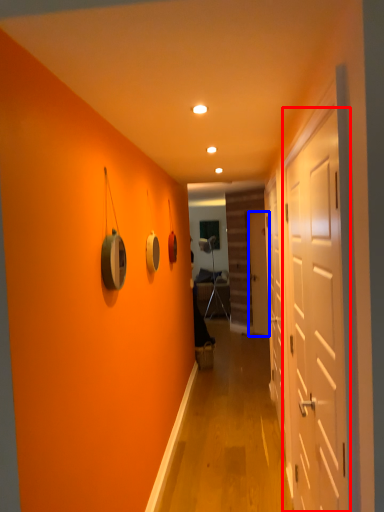
Question: Which object is further to the camera taking this photo, door (highlighted by a red box) or door (highlighted by a blue box)?

Choices:
 (A) door
 (B) door

Answer: (B)